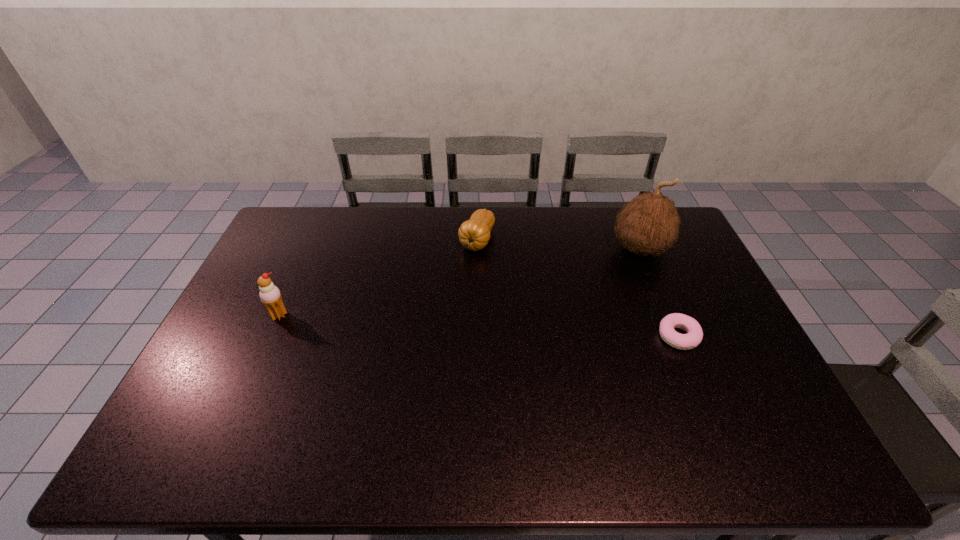
At what (x,y) coordinates should I click in order to perform the action: click on blank region between the gourd and the tallest object. Please return your answer as a coordinate pair (x, y). The height and width of the screenshot is (540, 960). Looking at the image, I should click on (559, 245).

Find the location of a particular element. This screenshot has height=540, width=960. free space between the icecream and the shortest object is located at coordinates (478, 326).

This screenshot has width=960, height=540. Identify the location of vacant space in between the leftmost object and the tallest object. (460, 282).

Choose which object is the nearest neighbor to the tallest object. Please provide its 2D coordinates. Your answer should be formatted as a tuple, i.e. [(x, y)], where the tuple contains the x and y coordinates of a point satisfying the conditions above.

[(692, 339)]

The image size is (960, 540). What are the coordinates of `the second closest object to the third shortest object` in the screenshot? It's located at (649, 224).

Identify the location of free location that satisfies the following two spatial constraints: 1. at the front with a straw on the pastry; 2. on the right side of the icecream. This screenshot has width=960, height=540. (270, 336).